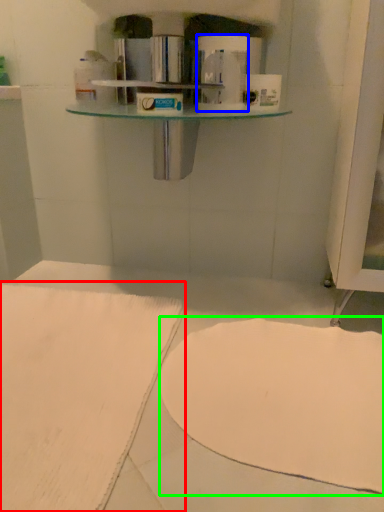
Question: Which is nearer to the sheet (highlighted by a red box)? toilet paper (highlighted by a blue box) or wide (highlighted by a green box).

Choices:
 (A) toilet paper
 (B) wide

Answer: (B)